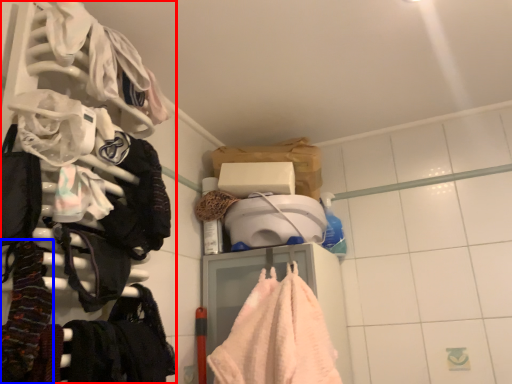
Question: Which point is closer to the camera, closet (highlighted by a red box) or clothing (highlighted by a blue box)?

Choices:
 (A) closet
 (B) clothing

Answer: (A)